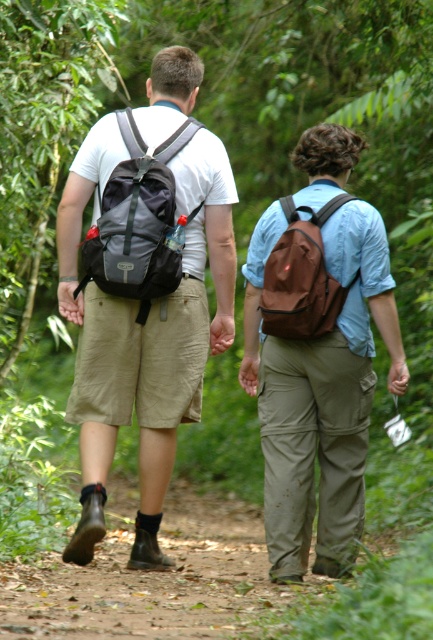
You are a photographer trying to capture a photo of the two hikers. The camera you are using has a focal point at coordinates point 0.5, 0.7. Where should you aim your camera to include the brown matte backpack at center in the photo?

The brown matte backpack at center is located at point (x=316, y=353), which is slightly to the right and above the camera focal point at (x=303, y=320). To include it in the photo, aim your camera slightly to the right and upward.

You are a photographer trying to capture the brown matte backpack at center. The camera is set to focus on the point at coordinates point (316, 353). Will this point be on the backpack?

Yes, the point (316, 353) is on the brown matte backpack at center, so the camera will focus on the backpack.